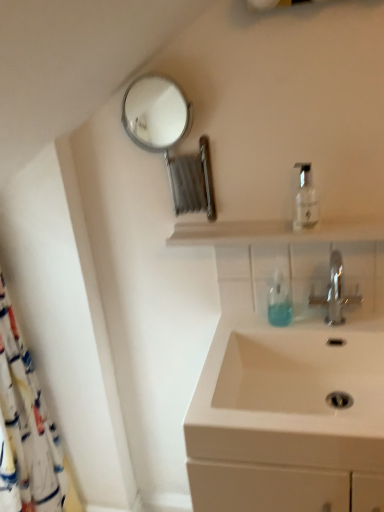
This screenshot has height=512, width=384. In order to click on empty space that is ontop of transparent glass shelf at center (from a real-world perspective) in this screenshot , I will do `click(270, 222)`.